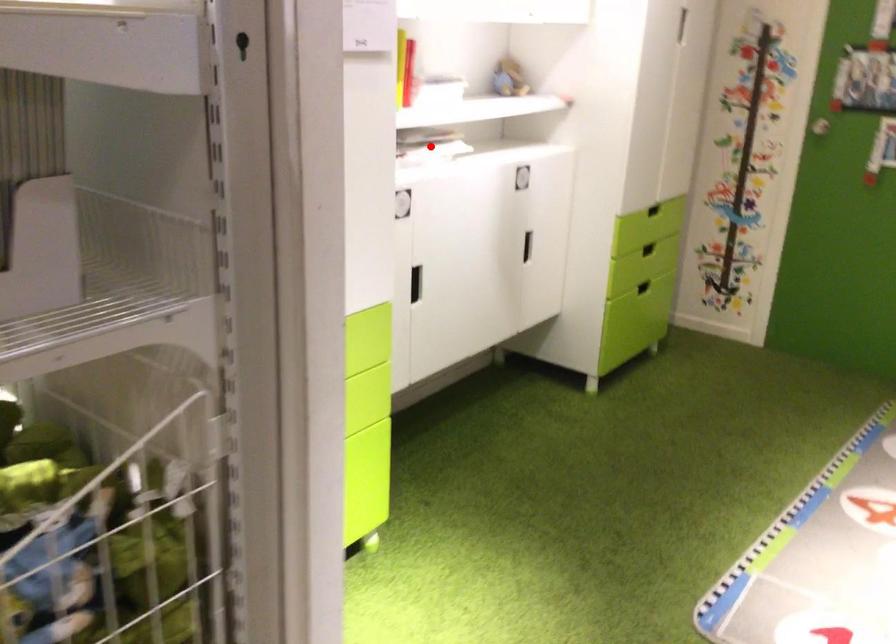
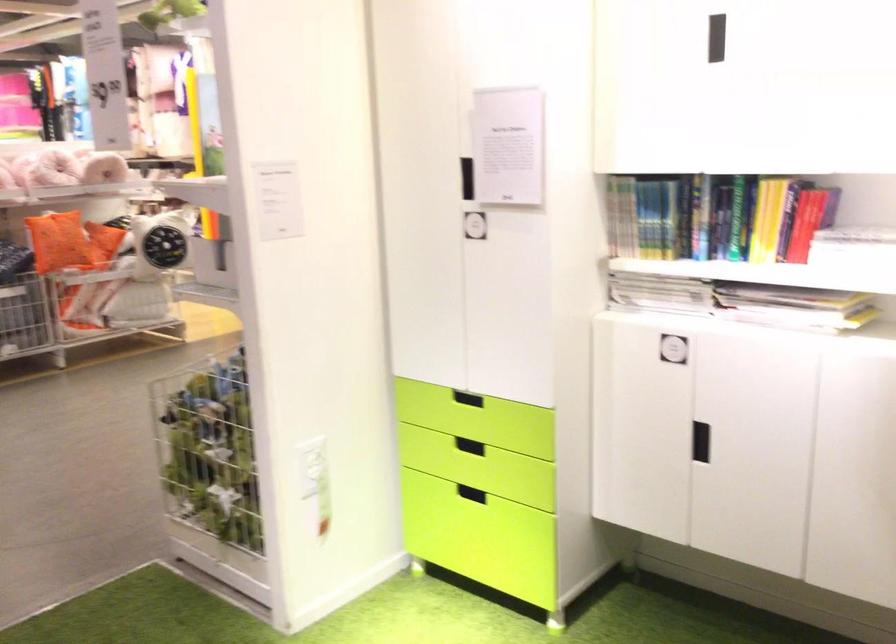
Find the pixel in the second image that matches the highlighted location in the first image.

(794, 307)